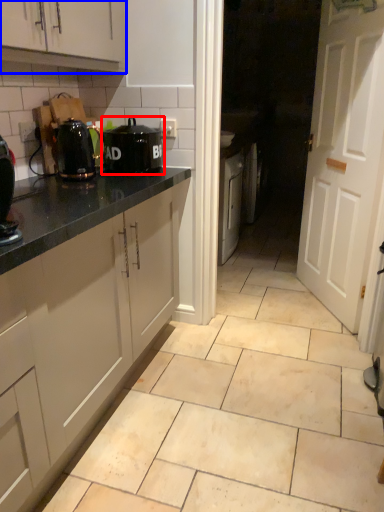
Question: Among these objects, which one is nearest to the camera, home appliance (highlighted by a red box) or cabinetry (highlighted by a blue box)?

Choices:
 (A) home appliance
 (B) cabinetry

Answer: (B)